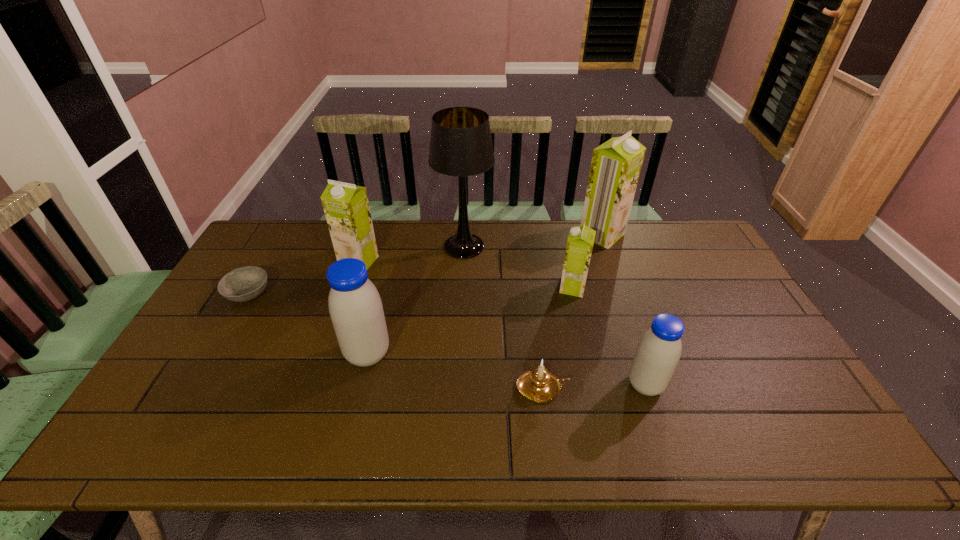
Identify the location of table lamp. (461, 145).

Find the location of a particular element. This screenshot has height=540, width=960. black table lamp is located at coordinates (461, 145).

Locate an element on the screen. the farthest green soya milk is located at coordinates (616, 164).

Where is `the rightmost green soya milk`? the rightmost green soya milk is located at coordinates (616, 164).

The width and height of the screenshot is (960, 540). What are the coordinates of `the leftmost green soya milk` in the screenshot? It's located at (346, 207).

This screenshot has width=960, height=540. In order to click on the second farthest soya milk in this screenshot , I will do `click(346, 207)`.

Locate an element on the screen. The image size is (960, 540). the bigger blue soya milk is located at coordinates (355, 307).

You are a GUI agent. You are given a task and a screenshot of the screen. Output one action in this format:
    pyautogui.click(x=<x>, y=<y>)
    Task: Click on the smallest green soya milk
    The width and height of the screenshot is (960, 540).
    Given the screenshot: What is the action you would take?
    pyautogui.click(x=580, y=242)

The image size is (960, 540). Find the location of `the sixth object from left to right`. the sixth object from left to right is located at coordinates (580, 242).

The image size is (960, 540). Find the location of `the right blue soya milk`. the right blue soya milk is located at coordinates (659, 350).